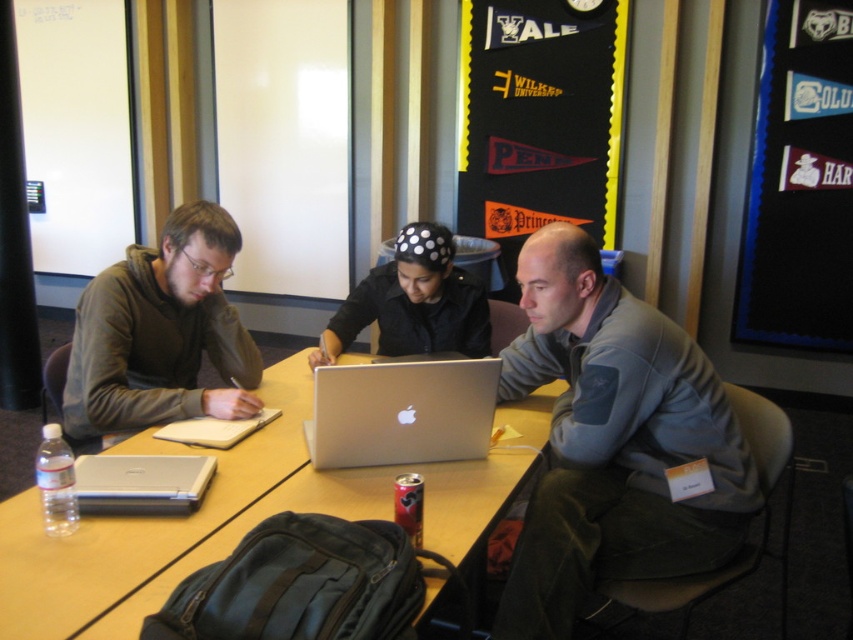
You are sitting at the wooden table at center and want to hand a document to the person wearing the matte gray hoodie at left. Since the table is between you and them, can you reach them directly without moving around the table?

The wooden table at center is in front of matte gray hoodie at left, so you can reach them directly by passing the document over the table since the table is between you and them.

You are a delivery robot with a package that needs to be placed on the wooden table at center. The package is 12 inches long. If you position the package so that one end is at the edge closest to the matte gray hoodie at left, will the entire package fit on the table?

The distance between the wooden table at center and the matte gray hoodie at left is 12.87 inches. Since the package is 12 inches long, placing it with one end at the edge near the matte gray hoodie at left would leave 0.87 inches of space remaining. This means the package will fit entirely on the table as there is enough space.